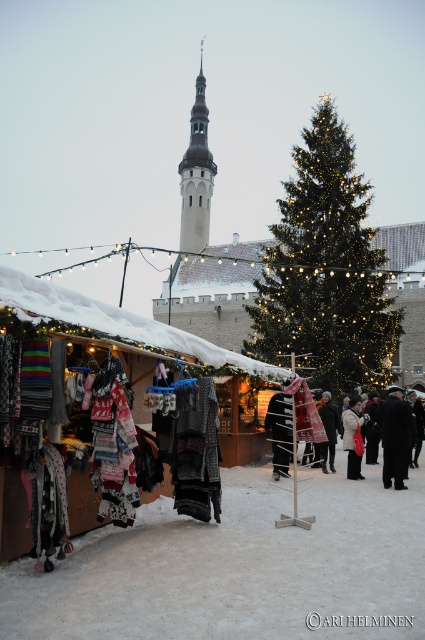
Question: Does white fur coat at center have a larger size compared to dark wool coat at center?

Choices:
 (A) no
 (B) yes

Answer: (A)

Question: Estimate the real-world distances between objects in this image. Which object is farther from the dark gray wool coat at center?

Choices:
 (A) smooth stone tower at upper center
 (B) black wool coat at center
 (C) illuminated green pine at center

Answer: (A)

Question: Which point appears farthest from the camera in this image?

Choices:
 (A) (286, 451)
 (B) (184, 177)
 (C) (413, 445)

Answer: (B)

Question: From the image, what is the correct spatial relationship of black woolen sweater at center in relation to dark gray wool coat at center?

Choices:
 (A) above
 (B) below

Answer: (A)

Question: Does smooth stone tower at upper center have a greater width compared to black woolen sweater at center?

Choices:
 (A) no
 (B) yes

Answer: (B)

Question: Which point is farther from the camera taking this photo?

Choices:
 (A) (277, 458)
 (B) (329, 400)
 (C) (385, 484)
 (D) (351, 445)

Answer: (B)